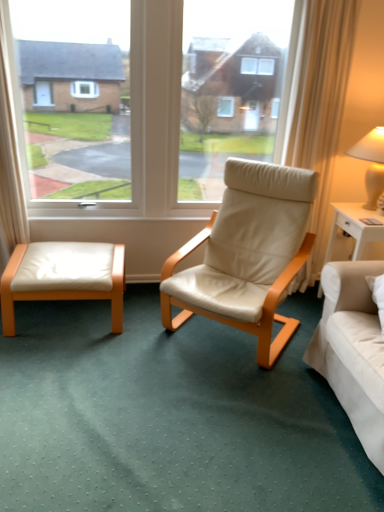
Question: Is the depth of white leather ottoman at lower left greater than that of white glossy nightstand at right?

Choices:
 (A) no
 (B) yes

Answer: (A)

Question: Is white leather ottoman at lower left completely or partially outside of white glossy nightstand at right?

Choices:
 (A) yes
 (B) no

Answer: (A)

Question: Does white leather ottoman at lower left have a smaller size compared to white glossy nightstand at right?

Choices:
 (A) yes
 (B) no

Answer: (B)

Question: Is the surface of white leather ottoman at lower left in direct contact with white glossy nightstand at right?

Choices:
 (A) yes
 (B) no

Answer: (B)

Question: Considering the relative sizes of white leather ottoman at lower left and white glossy nightstand at right in the image provided, is white leather ottoman at lower left bigger than white glossy nightstand at right?

Choices:
 (A) no
 (B) yes

Answer: (B)

Question: Looking at their shapes, would you say beige leather chair at center is wider or thinner than white leather ottoman at lower left?

Choices:
 (A) thin
 (B) wide

Answer: (B)

Question: Considering their positions, is beige leather chair at center located in front of or behind white leather ottoman at lower left?

Choices:
 (A) front
 (B) behind

Answer: (A)

Question: Looking at the image, does beige leather chair at center seem bigger or smaller compared to white leather ottoman at lower left?

Choices:
 (A) big
 (B) small

Answer: (A)

Question: Considering the positions of point (235, 321) and point (100, 291), is point (235, 321) closer or farther from the camera than point (100, 291)?

Choices:
 (A) farther
 (B) closer

Answer: (B)

Question: In terms of size, does white leather ottoman at lower left appear bigger or smaller than beige leather chair at center?

Choices:
 (A) small
 (B) big

Answer: (A)

Question: Relative to beige leather chair at center, is white leather ottoman at lower left in front or behind?

Choices:
 (A) front
 (B) behind

Answer: (B)

Question: In the image, is white leather ottoman at lower left on the left side or the right side of beige leather chair at center?

Choices:
 (A) right
 (B) left

Answer: (B)

Question: Considering the positions of point (109, 245) and point (271, 351), is point (109, 245) closer or farther from the camera than point (271, 351)?

Choices:
 (A) farther
 (B) closer

Answer: (A)

Question: Is point (367, 148) closer or farther from the camera than point (69, 249)?

Choices:
 (A) farther
 (B) closer

Answer: (B)

Question: Is matte beige lampshade at upper right bigger or smaller than white leather ottoman at lower left?

Choices:
 (A) big
 (B) small

Answer: (B)